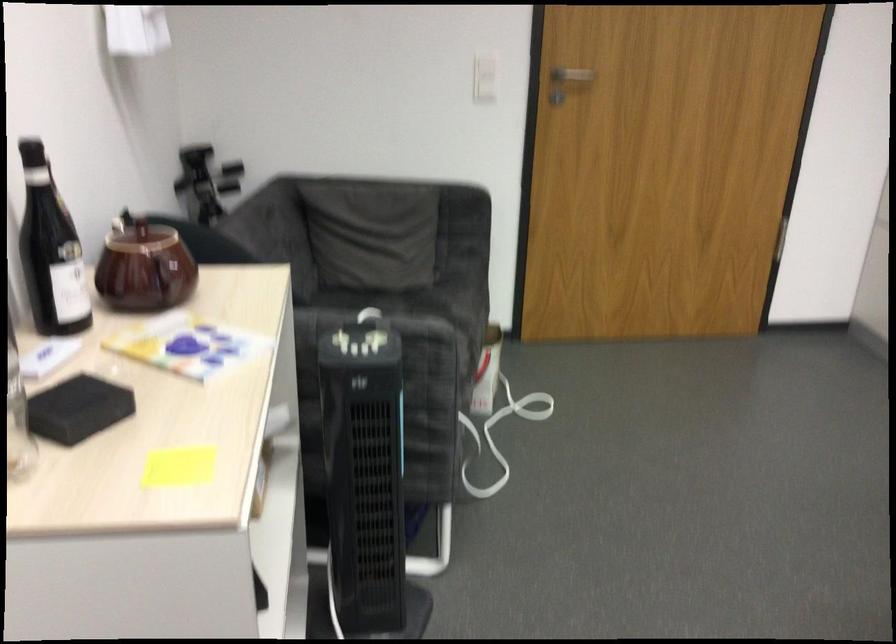
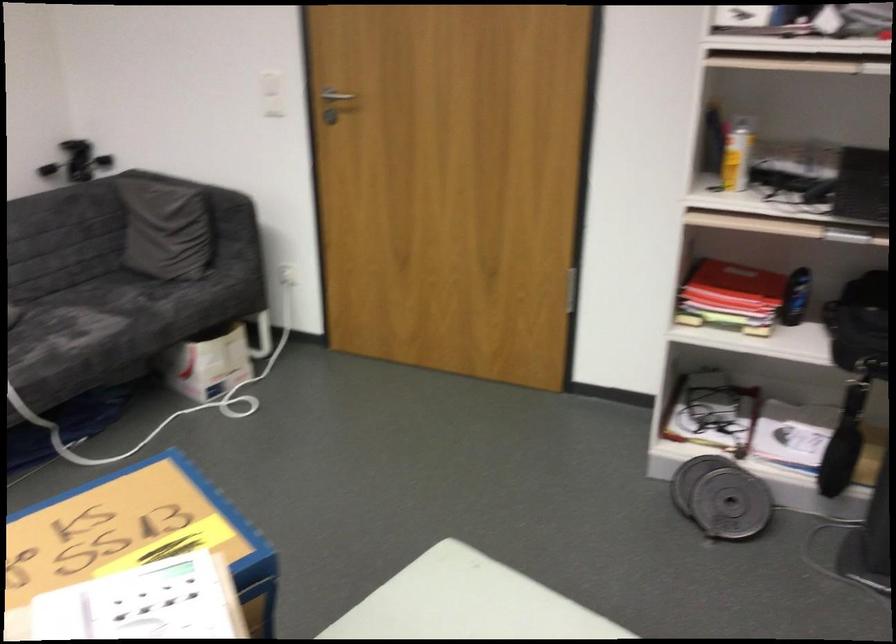
Find the pixel in the second image that matches (x=446, y=313) in the first image.

(156, 306)